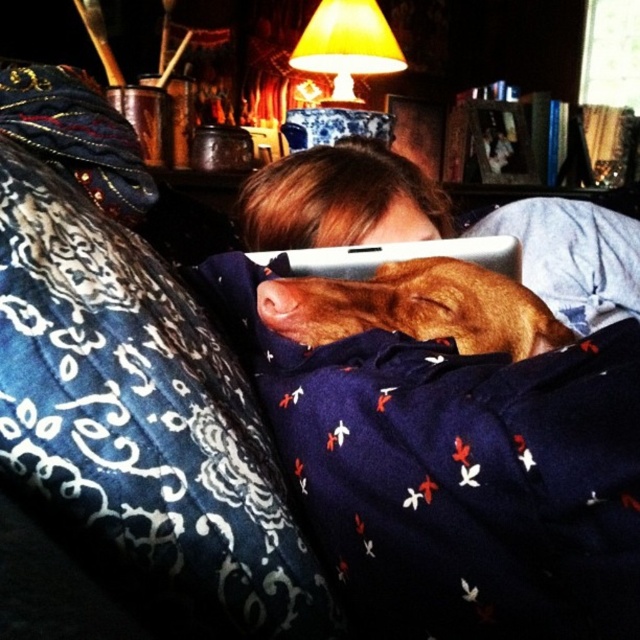
Who is more distant from viewer, (x=412, y=429) or (x=307, y=257)?

The point (x=307, y=257) is behind.

Does brown fur dog at center appear on the right side of white matte tablet at center?

In fact, brown fur dog at center is to the left of white matte tablet at center.

This screenshot has width=640, height=640. Describe the element at coordinates (456, 472) in the screenshot. I see `brown fur dog at center` at that location.

This screenshot has height=640, width=640. Find the location of `brown fur dog at center`. brown fur dog at center is located at coordinates (456, 472).

Is brown furry dog at center closer to the viewer compared to yellow fabric lampshade at upper center?

Yes, it is in front of yellow fabric lampshade at upper center.

What do you see at coordinates (417, 307) in the screenshot? The height and width of the screenshot is (640, 640). I see `brown furry dog at center` at bounding box center [417, 307].

Between point (348, 300) and point (362, 56), which one is positioned in front?

Point (348, 300) is in front.

Locate an element on the screen. The image size is (640, 640). brown furry dog at center is located at coordinates (417, 307).

Does brown fur dog at center have a smaller size compared to yellow fabric lampshade at upper center?

Correct, brown fur dog at center occupies less space than yellow fabric lampshade at upper center.

Which is in front, point (504, 332) or point (369, 56)?

Point (504, 332) is in front.

Locate an element on the screen. brown fur dog at center is located at coordinates click(x=456, y=472).